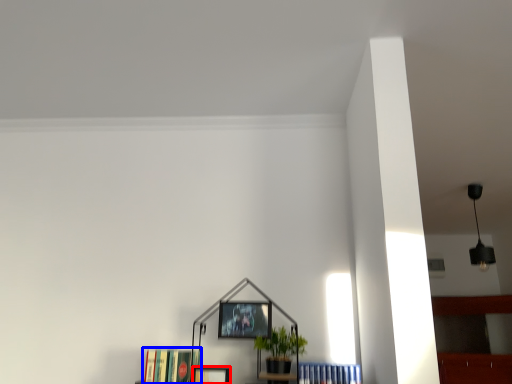
Question: Which object appears farthest to the camera in this image, picture frame (highlighted by a red box) or book (highlighted by a blue box)?

Choices:
 (A) picture frame
 (B) book

Answer: (A)